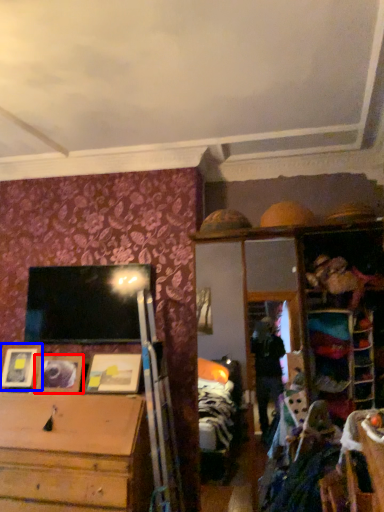
Question: Which of the following is the closest to the observer, picture frame (highlighted by a red box) or picture frame (highlighted by a blue box)?

Choices:
 (A) picture frame
 (B) picture frame

Answer: (A)